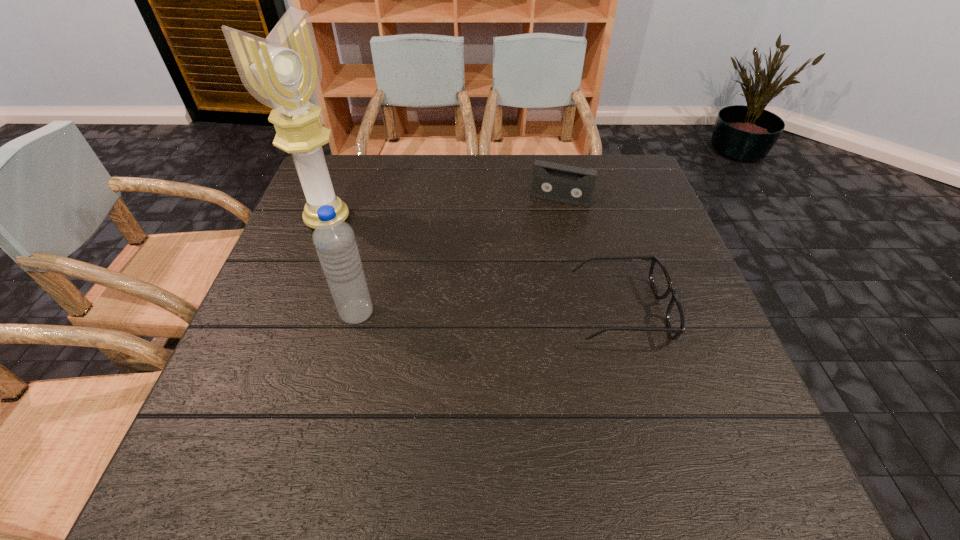
This screenshot has width=960, height=540. I want to click on empty location between the water bottle and the second shortest object, so click(x=459, y=256).

You are a GUI agent. You are given a task and a screenshot of the screen. Output one action in this format:
    pyautogui.click(x=<x>, y=<y>)
    Task: Click on the free spot between the spectacles and the third object from right to left
    The image size is (960, 540).
    Given the screenshot: What is the action you would take?
    pyautogui.click(x=489, y=312)

Identify the location of object that stands as the closest to the videotape. Image resolution: width=960 pixels, height=540 pixels. (660, 280).

Identify which object is the closest to the third shortest object. Please provide its 2D coordinates. Your answer should be formatted as a tuple, i.e. [(x, y)], where the tuple contains the x and y coordinates of a point satisfying the conditions above.

[(284, 72)]

You are a GUI agent. You are given a task and a screenshot of the screen. Output one action in this format:
    pyautogui.click(x=<x>, y=<y>)
    Task: Click on the vacant point that satisfies the following two spatial constraints: 1. on the front side of the spectacles; 2. on the front-facing side of the tallest object
    
    Given the screenshot: What is the action you would take?
    pyautogui.click(x=294, y=310)

The width and height of the screenshot is (960, 540). What are the coordinates of `vacant space that satisfies the following two spatial constraints: 1. on the back side of the second object from left to right; 2. on the left side of the second shortest object` in the screenshot? It's located at (385, 199).

Where is `free space that satisfies the following two spatial constraints: 1. on the front side of the award; 2. on the right side of the water bottle`? The width and height of the screenshot is (960, 540). free space that satisfies the following two spatial constraints: 1. on the front side of the award; 2. on the right side of the water bottle is located at coordinates (292, 313).

At what (x,y) coordinates should I click in order to perform the action: click on blank area in the image that satisfies the following two spatial constraints: 1. on the front side of the shortest object; 2. on the front-facing side of the leftmost object. Please return your answer as a coordinate pair (x, y). Looking at the image, I should click on (294, 310).